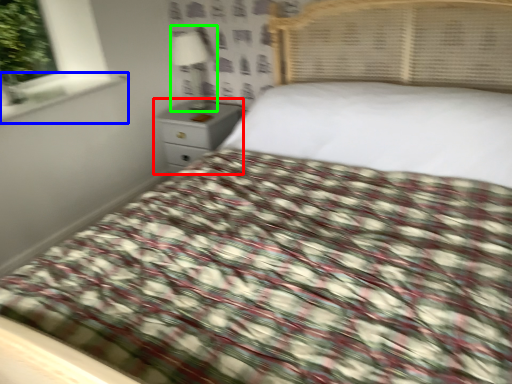
Question: Estimate the real-world distances between objects in this image. Which object is closer to nightstand (highlighted by a red box), window sill (highlighted by a blue box) or lamp (highlighted by a green box)?

Choices:
 (A) window sill
 (B) lamp

Answer: (B)